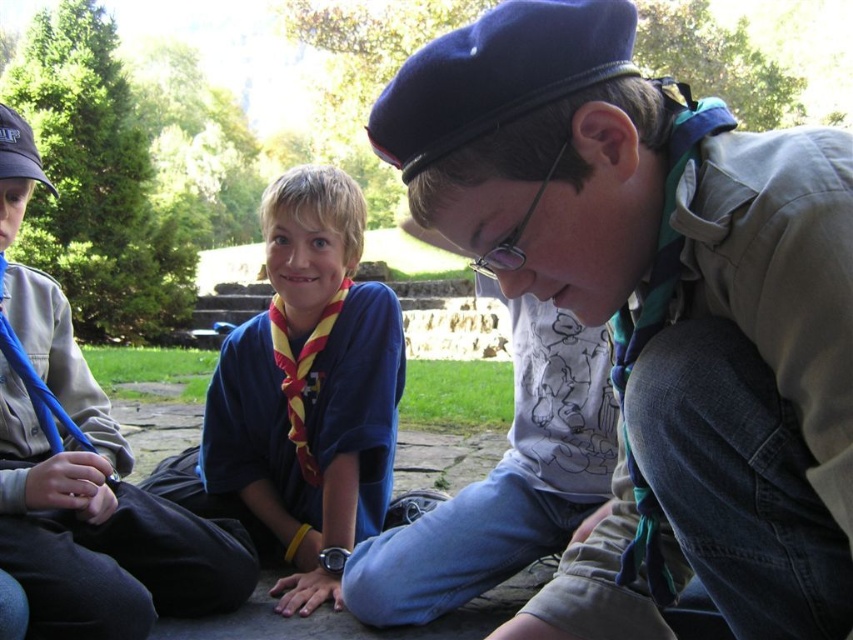
Question: Which of the following is the farthest from the observer?

Choices:
 (A) (379, 486)
 (B) (142, 612)
 (C) (643, 138)

Answer: (A)

Question: Can you confirm if matte khaki shirt at center is positioned above blue/yellow scarf at center?

Choices:
 (A) yes
 (B) no

Answer: (B)

Question: Does matte khaki shirt at center appear over blue/yellow scarf at center?

Choices:
 (A) no
 (B) yes

Answer: (A)

Question: Which object is closer to the camera taking this photo?

Choices:
 (A) blue fabric necktie at left
 (B) matte khaki shirt at center

Answer: (B)

Question: Can you confirm if matte khaki shirt at center is positioned above blue fabric necktie at left?

Choices:
 (A) no
 (B) yes

Answer: (B)

Question: Which of the following is the farthest from the observer?

Choices:
 (A) (610, 602)
 (B) (105, 532)

Answer: (B)